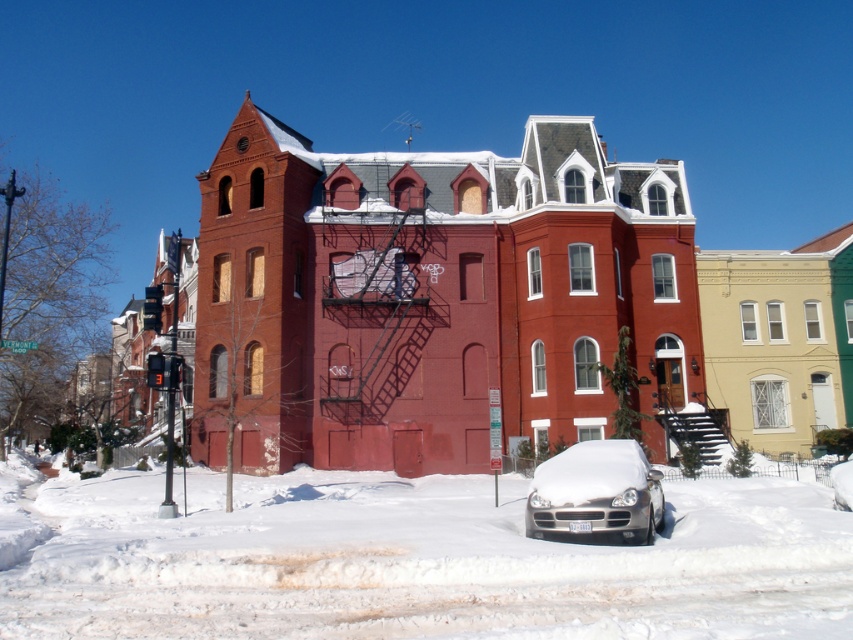
Between point (793, 490) and point (662, 500), which one is positioned behind?

Positioned behind is point (793, 490).

Who is higher up, white fluffy snow at center or silver metallic car at lower center?

silver metallic car at lower center is higher up.

Does point (225, 524) come behind point (531, 532)?

Yes, point (225, 524) is farther from viewer.

Locate an element on the screen. white fluffy snow at center is located at coordinates (410, 561).